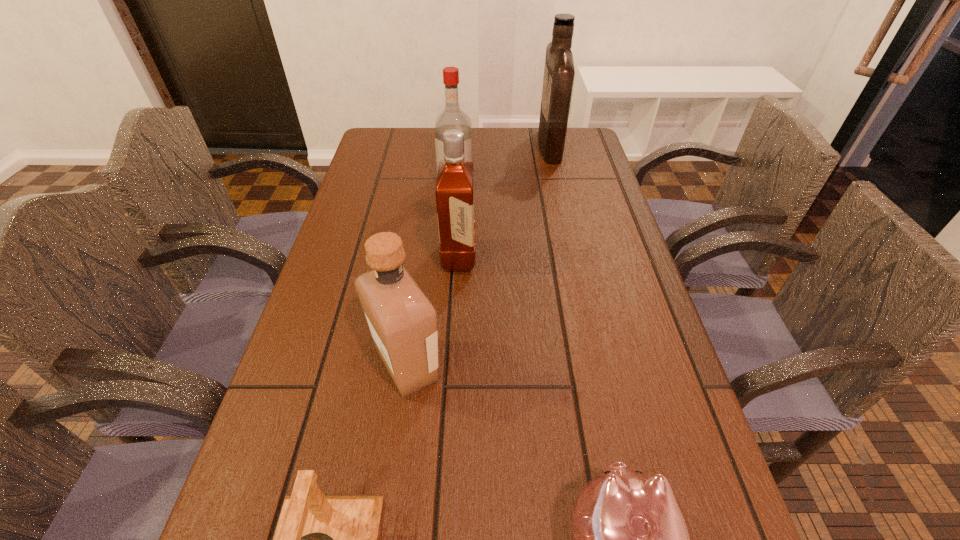
Where is `the farthest object`? the farthest object is located at coordinates (559, 71).

I want to click on the tallest liquor, so click(x=559, y=71).

The width and height of the screenshot is (960, 540). I want to click on the third farthest object, so click(455, 181).

At what (x,y) coordinates should I click in order to perform the action: click on the fifth nearest object. Please return your answer as a coordinate pair (x, y). This screenshot has height=540, width=960. Looking at the image, I should click on (452, 117).

This screenshot has width=960, height=540. I want to click on the nearest liquor, so click(x=402, y=321).

Locate an element on the screen. The height and width of the screenshot is (540, 960). free space located 0.130m on the label side of the farthest liquor is located at coordinates 498,146.

Identify the location of free region located 0.150m on the label side of the farthest liquor. (492, 146).

Locate an element on the screen. The image size is (960, 540). free space located on the label side of the farthest liquor is located at coordinates pos(435,146).

Find the location of a particular element. vacant space located on the front label of the second nearest liquor is located at coordinates (571, 257).

You are a GUI agent. You are given a task and a screenshot of the screen. Output one action in this format:
    pyautogui.click(x=<x>, y=<y>)
    Task: Click on the vacant space located 0.280m on the front-facing side of the second farthest liquor
    The image size is (960, 540).
    Given the screenshot: What is the action you would take?
    pyautogui.click(x=450, y=256)